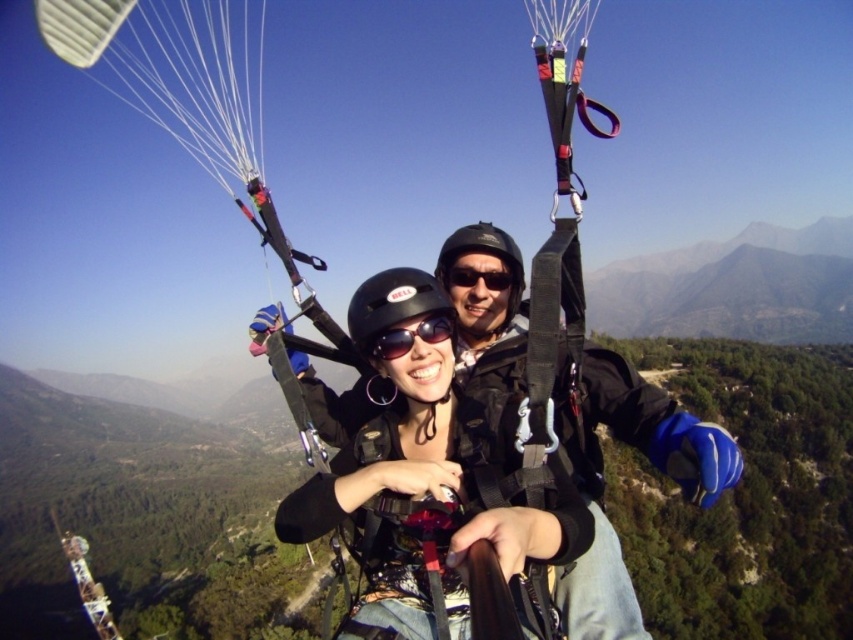
Between point (550, 525) and point (444, 276), which one is positioned behind?

Positioned behind is point (444, 276).

Measure the distance between matte black helmet at center and black plastic goggles at center.

12.50 meters

Does point (460, 410) come closer to viewer compared to point (453, 280)?

That is True.

Find the location of a particular element. Image resolution: width=853 pixels, height=640 pixels. matte black helmet at center is located at coordinates (428, 474).

Can you confirm if matte black goggles at center is positioned below black plastic goggles at center?

Yes, matte black goggles at center is below black plastic goggles at center.

Which is behind, point (405, 348) or point (492, 275)?

The point (492, 275) is more distant.

At what (x,y) coordinates should I click in order to perform the action: click on matte black goggles at center. Please return your answer as a coordinate pair (x, y). Looking at the image, I should click on (410, 336).

Between matte black helmet at center and matte black goggles at center, which one appears on the right side from the viewer's perspective?

matte black goggles at center

Is matte black helmet at center taller than matte black goggles at center?

Indeed, matte black helmet at center has a greater height compared to matte black goggles at center.

Who is more forward, (x=503, y=508) or (x=451, y=310)?

Positioned in front is point (x=503, y=508).

Where is `matte black helmet at center`? This screenshot has width=853, height=640. matte black helmet at center is located at coordinates (428, 474).